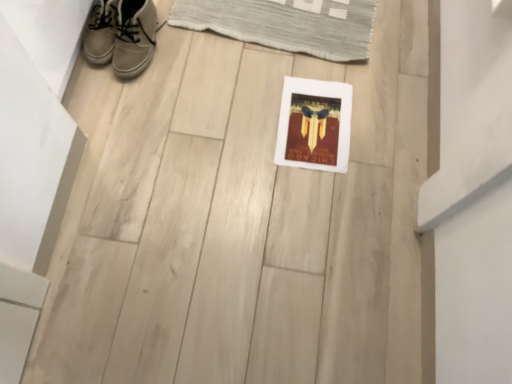
You are a GUI agent. You are given a task and a screenshot of the screen. Output one action in this format:
    pyautogui.click(x=<x>, y=<y>)
    Task: Click on the free space in front of white matte picture frame at center
    Image resolution: width=512 pixels, height=384 pixels.
    Given the screenshot: What is the action you would take?
    pyautogui.click(x=310, y=203)